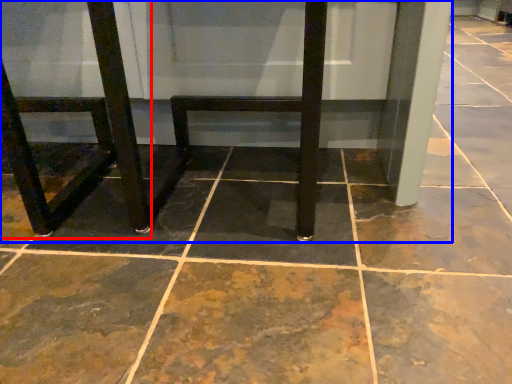
Question: Which point is further to the camera, chair (highlighted by a red box) or furniture (highlighted by a blue box)?

Choices:
 (A) chair
 (B) furniture

Answer: (B)